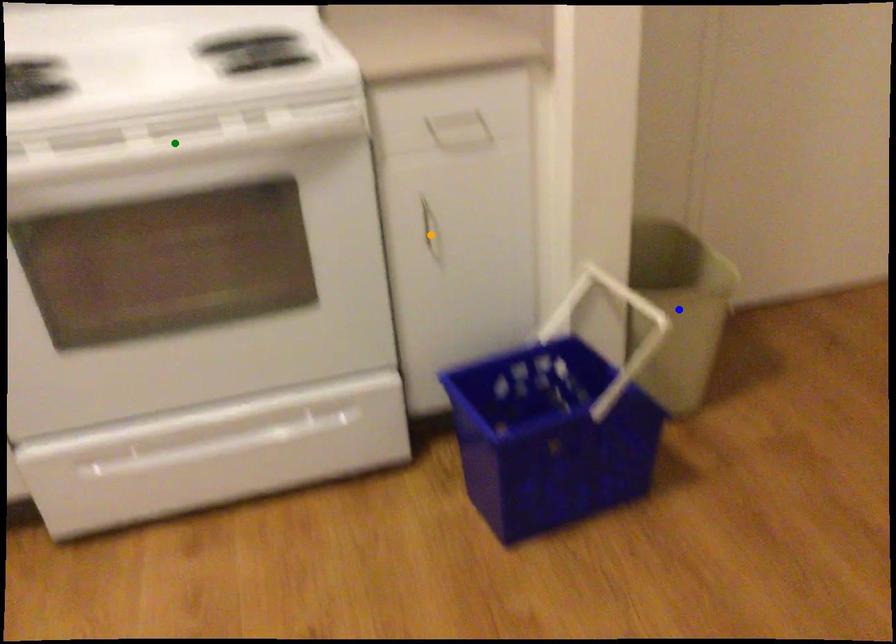
Order these from nearest to farthest:
blue point | green point | orange point

1. green point
2. orange point
3. blue point